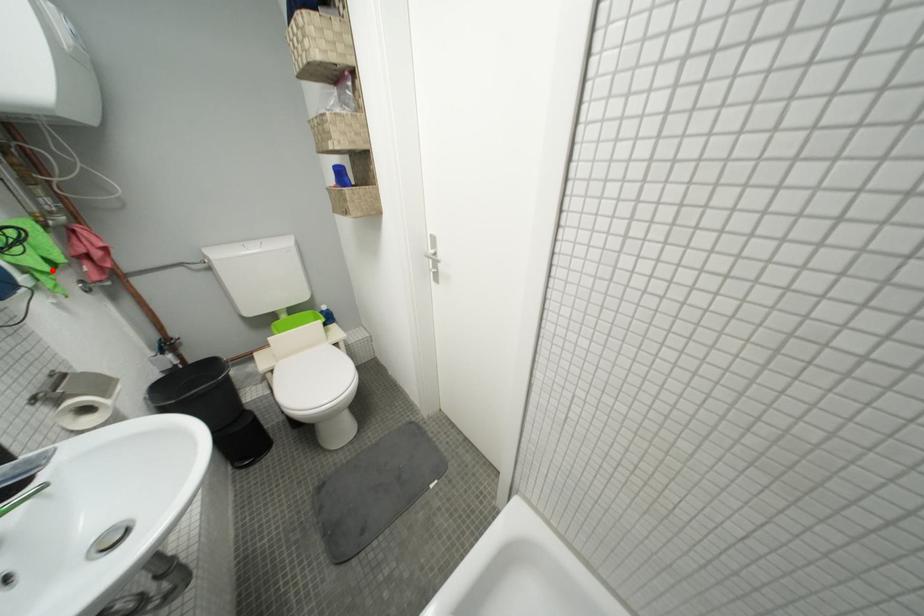
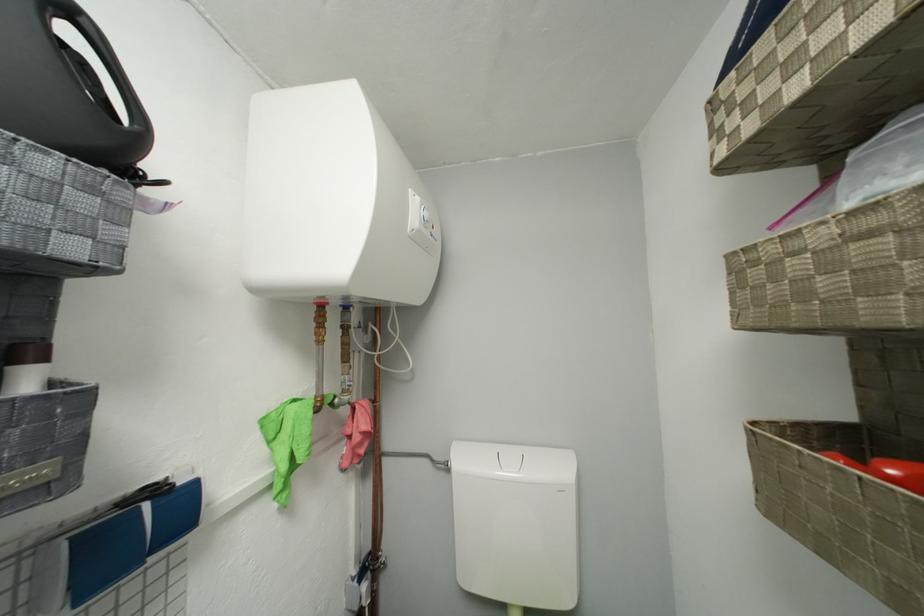
Question: I am providing you with two images of the same scene from different viewpoints. Given a red point in image1, look at the same physical point in image2. Is it:

Choices:
 (A) Closer to the viewpoint
 (B) Farther from the viewpoint

Answer: (A)